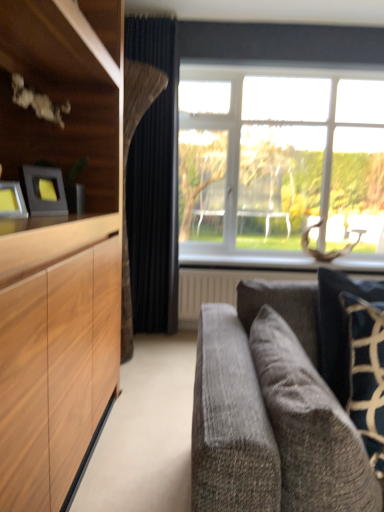
Question: In the image, is metallic silver picture frame at left, positioned as the first picture frame in front-to-back order, positioned in front of or behind clear glass window at center?

Choices:
 (A) behind
 (B) front

Answer: (B)

Question: Is metallic silver picture frame at left, which is the 2th picture frame in back-to-front order, to the left or to the right of clear glass window at center in the image?

Choices:
 (A) right
 (B) left

Answer: (B)

Question: Based on their relative distances, which object is farther from the metallic silver picture frame at left, positioned as the first picture frame in front-to-back order?

Choices:
 (A) white textured radiator at lower center
 (B) matte black picture frame at left, placed as the first picture frame when sorted from back to front
 (C) dark blue velvet curtain at center
 (D) clear glass window at center
 (E) velvet gray couch at lower right

Answer: (D)

Question: Which object is the closest to the metallic silver picture frame at left, positioned as the first picture frame in front-to-back order?

Choices:
 (A) velvet gray couch at lower right
 (B) white textured radiator at lower center
 (C) clear glass window at center
 (D) matte black picture frame at left, which is the second picture frame from front to back
 (E) velvet dark blue pillow at right

Answer: (D)